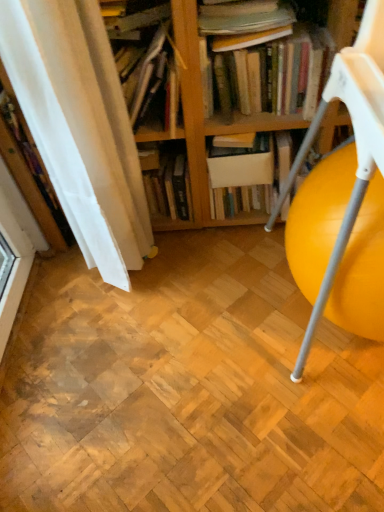
In order to click on vacant space situated above hardcover books at upper center, the first book viewed from the right (from a real-world perspective) in this screenshot , I will do `click(276, 34)`.